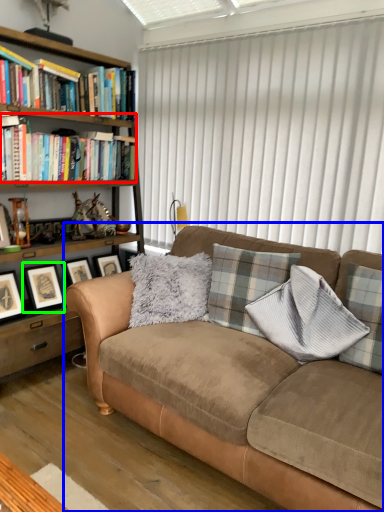
Question: Based on their relative distances, which object is nearer to book (highlighted by a red box)? Choose from studio couch (highlighted by a blue box) and picture frame (highlighted by a green box).

Choices:
 (A) studio couch
 (B) picture frame

Answer: (B)